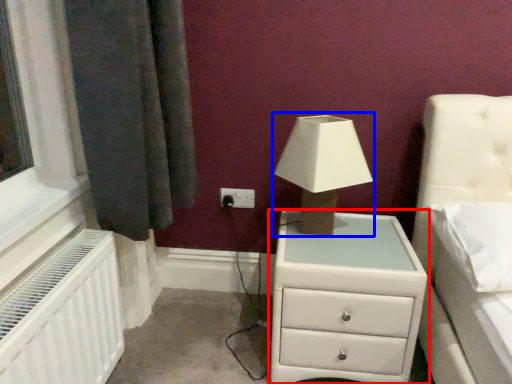
Question: Which of the following is the farthest to the observer, chest of drawers (highlighted by a red box) or table lamp (highlighted by a blue box)?

Choices:
 (A) chest of drawers
 (B) table lamp

Answer: (B)